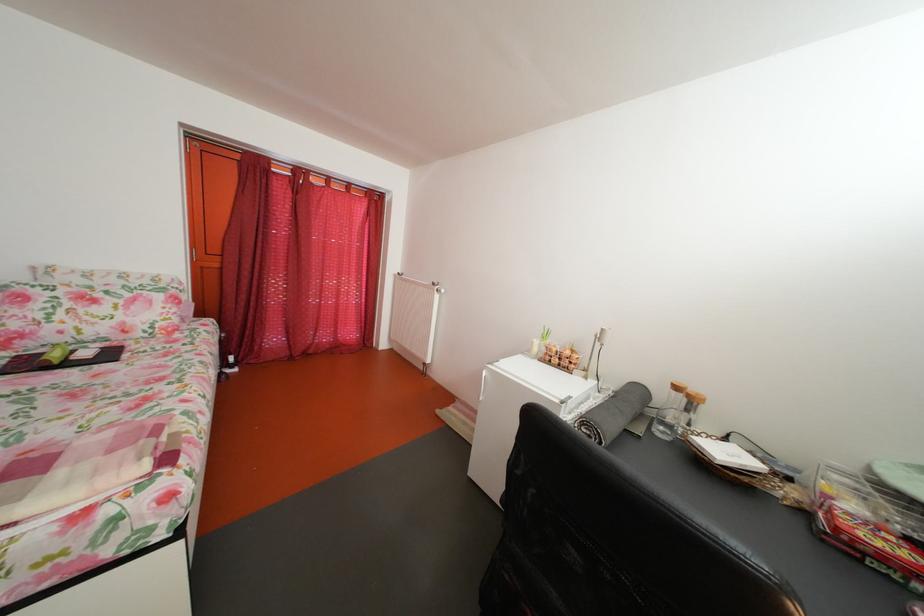
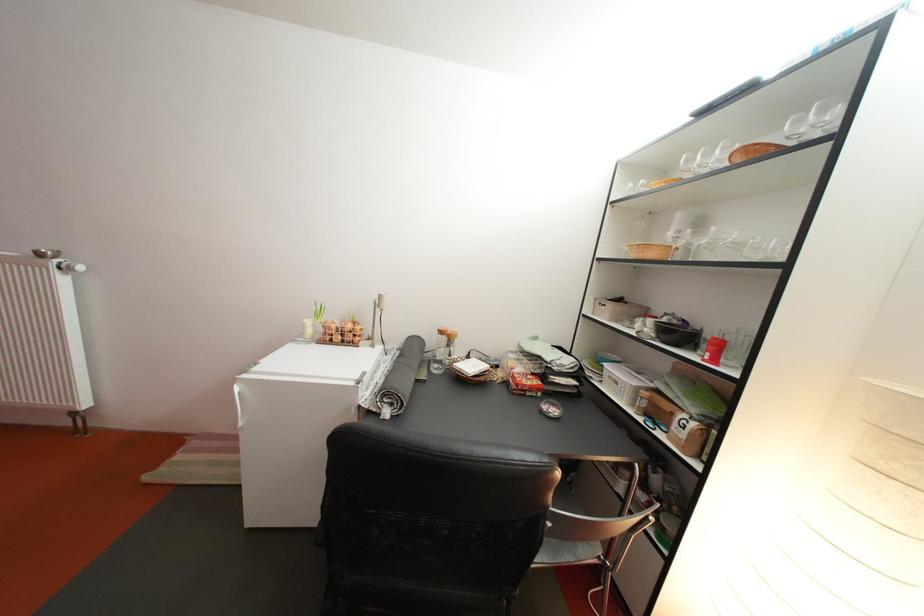
Question: The camera is either moving clockwise (left) or counter-clockwise (right) around the object. The first image is from the beginning of the video and the second image is from the end. Is the camera moving left or right when shooting the video?

Choices:
 (A) Left
 (B) Right

Answer: (A)